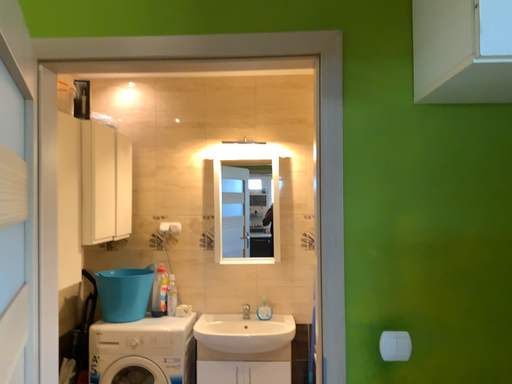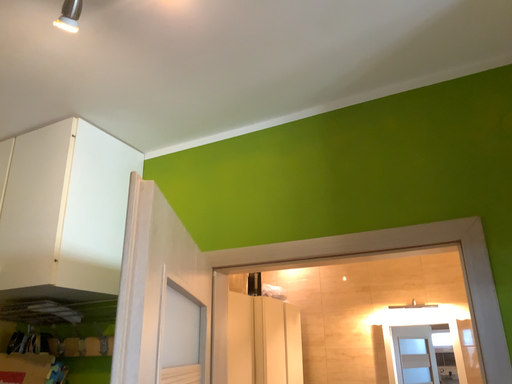
Question: How did the camera likely rotate when shooting the video?

Choices:
 (A) rotated downward
 (B) rotated upward

Answer: (B)